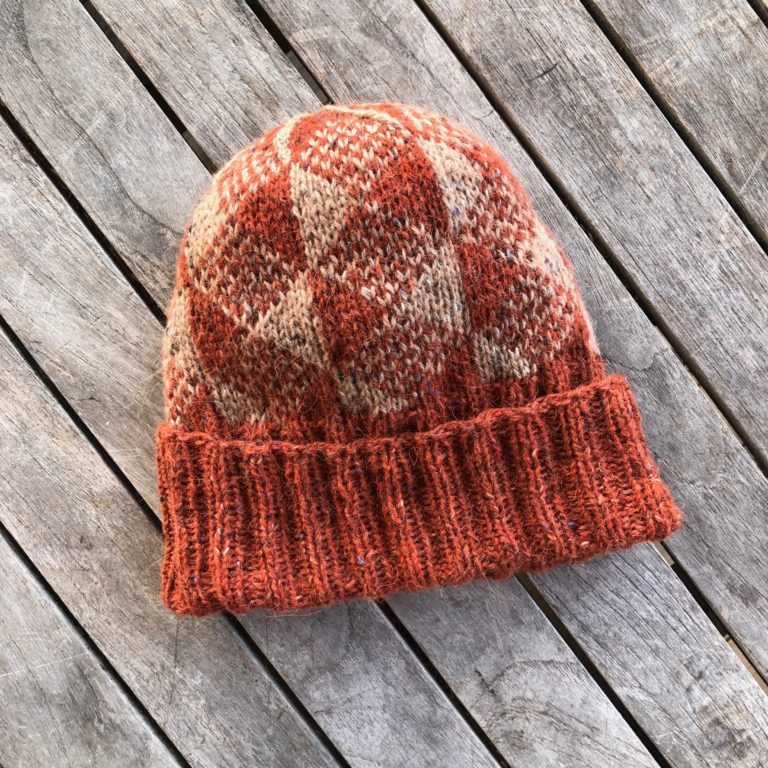
Find the location of a particular element. The image size is (768, 768). wooden table is located at coordinates (84, 346).